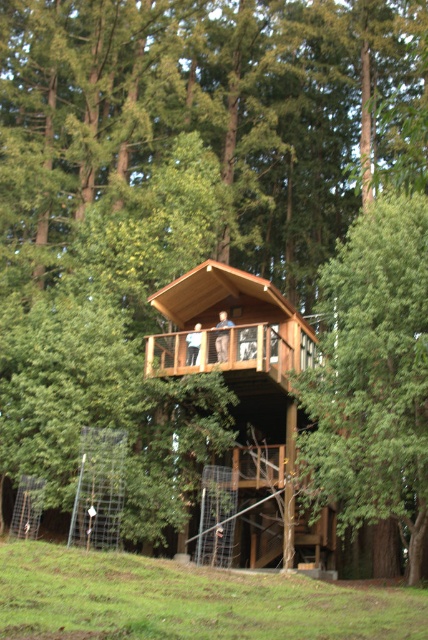
Does green leafy tree at center have a lesser width compared to wooden cabin at center?

Indeed, green leafy tree at center has a lesser width compared to wooden cabin at center.

Measure the distance between point (422, 454) and camera.

A distance of 18.80 meters exists between point (422, 454) and camera.

Find the location of a particular element. Image resolution: width=428 pixels, height=640 pixels. green leafy tree at center is located at coordinates (372, 376).

Identify the location of green leafy tree at center. The image size is (428, 640). (372, 376).